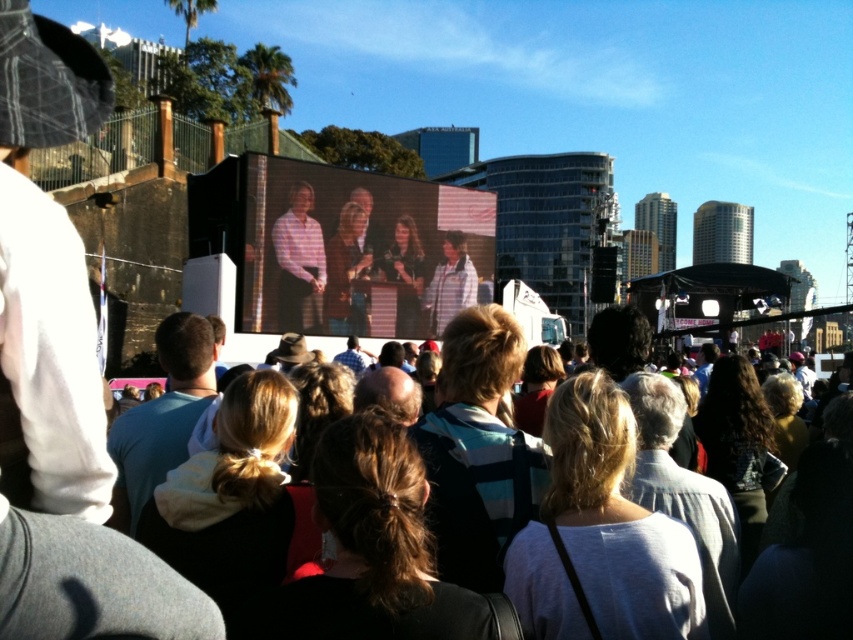
Can you confirm if matte screen at center is shorter than plaid shirt at center?

Incorrect, matte screen at center's height does not fall short of plaid shirt at center's.

Is matte screen at center further to the viewer compared to plaid shirt at center?

No.

At what (x,y) coordinates should I click in order to perform the action: click on matte screen at center. Please return your answer as a coordinate pair (x, y). The height and width of the screenshot is (640, 853). Looking at the image, I should click on [x=358, y=250].

Is point (659, 387) farther from viewer compared to point (283, 216)?

No, it is not.

Is light brown hair at center closer to the viewer compared to plaid shirt at center?

Yes, light brown hair at center is closer to the viewer.

Is point (651, 410) in front of point (311, 195)?

Yes, point (651, 410) is closer to viewer.

The image size is (853, 640). I want to click on light brown hair at center, so click(x=721, y=456).

Which is behind, point (485, 289) or point (650, 371)?

The point (485, 289) is behind.

Can you confirm if matte screen at center is taller than light brown hair at center?

No.

Is point (363, 230) in front of point (666, 458)?

No, it is not.

Image resolution: width=853 pixels, height=640 pixels. I want to click on matte screen at center, so pos(358,250).